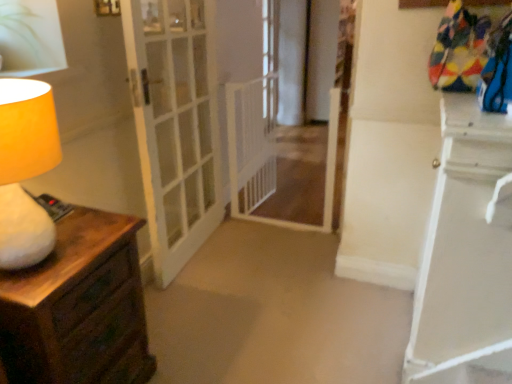
What are the coordinates of `clear glass window at center` in the screenshot? It's located at (270, 63).

This screenshot has height=384, width=512. What do you see at coordinates (78, 307) in the screenshot?
I see `wooden chest of drawers at left` at bounding box center [78, 307].

I want to click on wooden chest of drawers at left, so (x=78, y=307).

Find the location of a particular element. Image resolution: width=512 pixels, height=384 pixels. green leafy plant at upper left is located at coordinates (30, 35).

Relative to clear glass window at center, is white glossy nightstand at right in front or behind?

Clearly, white glossy nightstand at right is in front of clear glass window at center.

Is point (496, 119) closer to camera compared to point (277, 85)?

That is True.

Is white glossy nightstand at right located outside clear glass window at center?

That's correct, white glossy nightstand at right is outside of clear glass window at center.

From a real-world perspective, who is located higher, wooden chest of drawers at left or clear glass window at center?

clear glass window at center.

Locate an element on the screen. This screenshot has width=512, height=384. window that is above the wooden chest of drawers at left (from the image's perspective) is located at coordinates (270, 63).

Is wooden chest of drawers at left taller or shorter than clear glass window at center?

In the image, wooden chest of drawers at left appears to be shorter than clear glass window at center.

From the image's perspective, which is above, white glass door at center or wooden chest of drawers at left?

From the image's view, white glass door at center is above.

Considering the relative positions of white glass door at center and wooden chest of drawers at left in the image provided, is white glass door at center behind wooden chest of drawers at left?

That is True.

Are white glass door at center and wooden chest of drawers at left beside each other?

There is a gap between white glass door at center and wooden chest of drawers at left.

Is white glossy nightstand at right bigger than white glass door at center?

No, white glossy nightstand at right is not bigger than white glass door at center.

Which object is thinner, white glossy nightstand at right or white glass door at center?

Thinner between the two is white glossy nightstand at right.

Image resolution: width=512 pixels, height=384 pixels. What are the coordinates of `nightstand below the white glass door at center (from the image's perspective)` in the screenshot? It's located at (464, 253).

How distant is wooden chest of drawers at left from white glass door at center?

The distance of wooden chest of drawers at left from white glass door at center is 34.82 inches.

Is wooden chest of drawers at left closer to camera compared to white glass door at center?

Yes, wooden chest of drawers at left is in front of white glass door at center.

From the image's perspective, is wooden chest of drawers at left on top of white glass door at center?

Incorrect, from the image's perspective, wooden chest of drawers at left is lower than white glass door at center.

Consider the image. Is wooden chest of drawers at left not close to white glass door at center?

No, wooden chest of drawers at left is not far away from white glass door at center.

Is point (275, 100) positioned before point (151, 13)?

That is False.

From the image's perspective, is clear glass window at center under white glass door at center?

No, from the image's perspective, clear glass window at center is not below white glass door at center.

From a real-world perspective, which object stands above the other?

In real-world perspective, clear glass window at center is above.

Which is in front, white glossy nightstand at right or matte yellow lampshade at left?

matte yellow lampshade at left.

From a real-world perspective, relative to matte yellow lampshade at left, is white glossy nightstand at right vertically above or below?

white glossy nightstand at right is below matte yellow lampshade at left.

Is white glossy nightstand at right directly adjacent to matte yellow lampshade at left?

No, white glossy nightstand at right is not in contact with matte yellow lampshade at left.

Locate an element on the screen. This screenshot has height=384, width=512. window above the white glossy nightstand at right (from the image's perspective) is located at coordinates (270, 63).

You are a GUI agent. You are given a task and a screenshot of the screen. Output one action in this format:
    pyautogui.click(x=<x>, y=<y>)
    Task: Click on the chest of drawers located below the clear glass window at center (from the image's perspective)
    The height and width of the screenshot is (384, 512).
    Given the screenshot: What is the action you would take?
    pyautogui.click(x=78, y=307)

From the image, which object appears to be nearer to clear glass window at center, matte yellow lampshade at left or wooden chest of drawers at left?

The object closer to clear glass window at center is wooden chest of drawers at left.

Based on their spatial positions, is green leafy plant at upper left or matte yellow lampshade at left further from white mesh gate at center?

matte yellow lampshade at left.

When comparing their distances from white glass door at center, does green leafy plant at upper left or white mesh gate at center seem further?

Based on the image, green leafy plant at upper left appears to be further to white glass door at center.

When comparing their distances from white glass door at center, does white mesh gate at center or wooden chest of drawers at left seem closer?

The object closer to white glass door at center is white mesh gate at center.

From the image, which object appears to be farther from white mesh gate at center, wooden chest of drawers at left or matte yellow lampshade at left?

Based on the image, matte yellow lampshade at left appears to be further to white mesh gate at center.

Estimate the real-world distances between objects in this image. Which object is closer to white glass door at center, clear glass window at center or green leafy plant at upper left?

The object closer to white glass door at center is green leafy plant at upper left.

Estimate the real-world distances between objects in this image. Which object is closer to white mesh gate at center, white glass door at center or green leafy plant at upper left?

white glass door at center lies closer to white mesh gate at center than the other object.

Estimate the real-world distances between objects in this image. Which object is further from wooden chest of drawers at left, clear glass window at center or white glass door at center?

clear glass window at center is positioned further to the anchor wooden chest of drawers at left.

The height and width of the screenshot is (384, 512). In order to click on passage between white glass door at center and white glossy nightstand at right in this screenshot , I will do `click(287, 156)`.

Identify the location of chest of drawers between matte yellow lampshade at left and white glass door at center along the z-axis. (78, 307).

Find the location of a particular element. door between wooden chest of drawers at left and white glossy nightstand at right in the horizontal direction is located at coordinates (175, 124).

Locate an element on the screen. The width and height of the screenshot is (512, 384). the chest of drawers located between matte yellow lampshade at left and white glossy nightstand at right in the left-right direction is located at coordinates (78, 307).